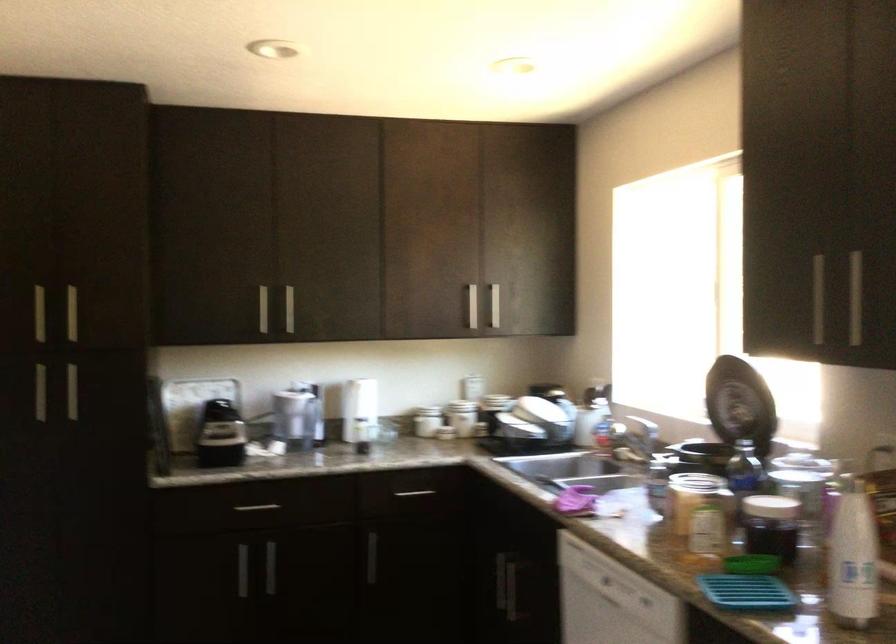
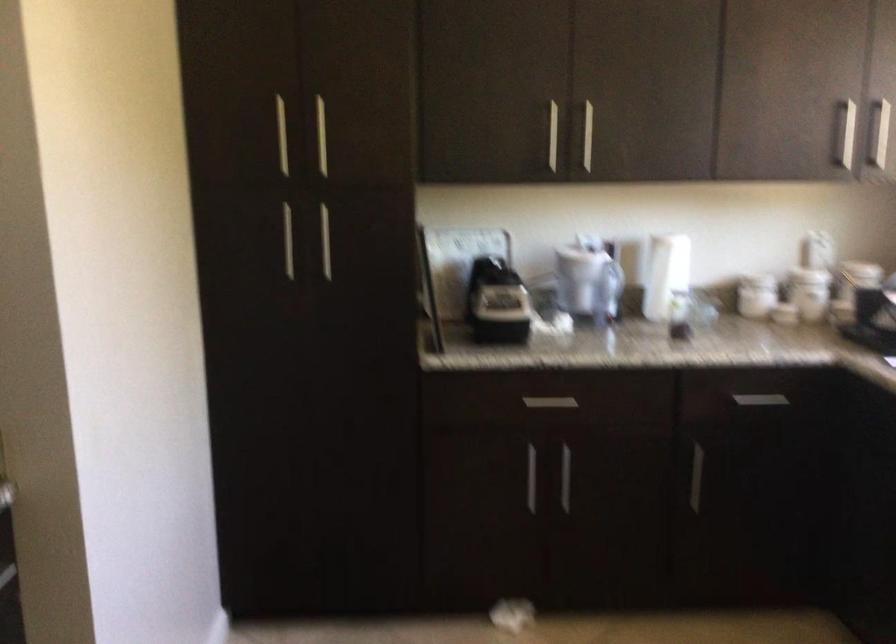
The point at (x=277, y=569) is marked in the first image. Where is the corresponding point in the second image?

(565, 478)